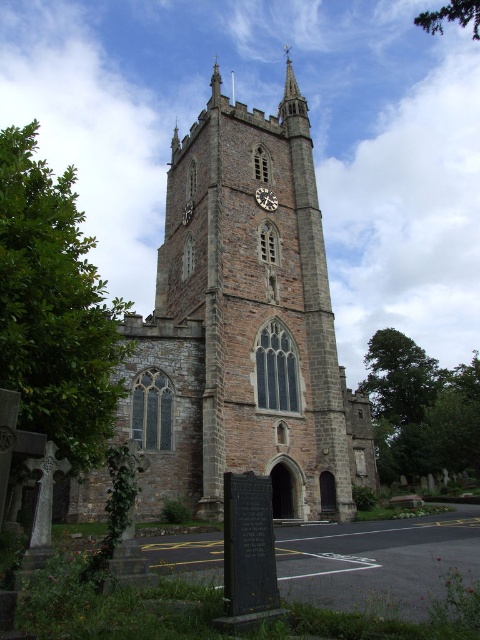
You are an architect assessing the proportions of the stone church at center and the dark gray stone clock at center. Which object occupies more space in the image?

The stone church at center is larger in size than the dark gray stone clock at center, so it occupies more space in the image.

You are a tour guide explaining the architecture of the stone church at center and the dark gray stone clock at center. Which one is taller?

The stone church at center is taller than the dark gray stone clock at center.

You are a maintenance worker needing to reach both the stone church at center and the dark gray stone clock at center for repairs. Given that your ladder can extend up to 15 meters, can you safely reach both objects with a single ladder setup?

The stone church at center and dark gray stone clock at center are 14.57 meters apart, so yes, you can safely reach both objects with a single ladder setup since the distance is within the ladder extension limit of 15 meters.